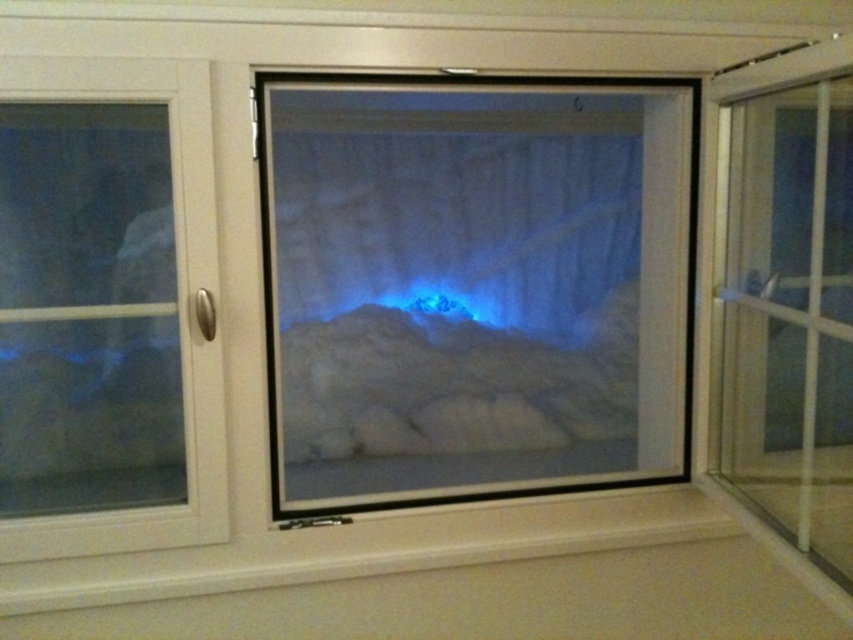
Question: Where is transparent glass screen door at center located in relation to transparent glass door at right in the image?

Choices:
 (A) right
 (B) left

Answer: (B)

Question: Is transparent glass screen door at center positioned in front of transparent glass door at right?

Choices:
 (A) yes
 (B) no

Answer: (B)

Question: Which of the following is the farthest from the observer?

Choices:
 (A) transparent glass door at right
 (B) transparent glass screen door at center

Answer: (B)

Question: Is transparent glass screen door at center thinner than transparent glass door at right?

Choices:
 (A) no
 (B) yes

Answer: (A)